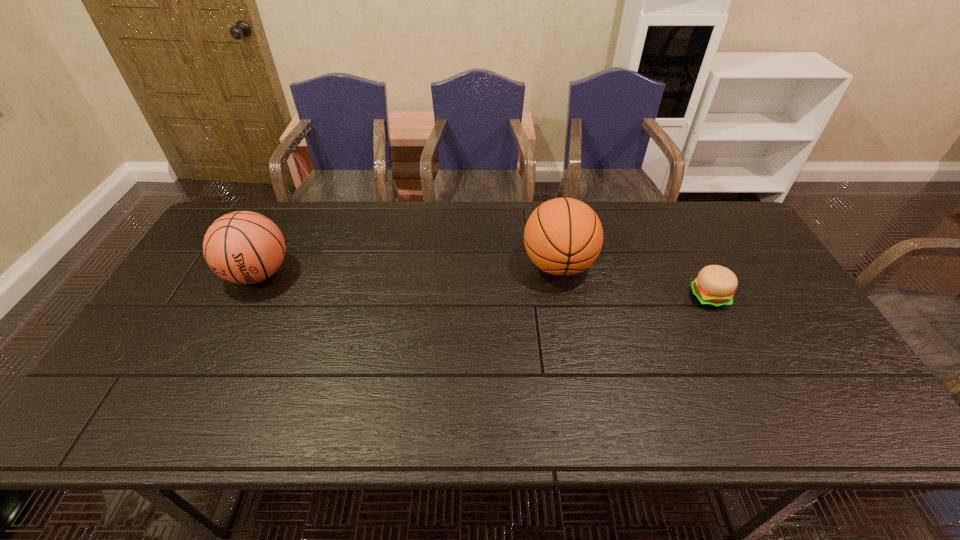
Locate an element on the screen. Image resolution: width=960 pixels, height=540 pixels. free spot that satisfies the following two spatial constraints: 1. on the front side of the right basketball; 2. on the left side of the rightmost object is located at coordinates (564, 297).

You are a GUI agent. You are given a task and a screenshot of the screen. Output one action in this format:
    pyautogui.click(x=<x>, y=<y>)
    Task: Click on the free location that satisfies the following two spatial constraints: 1. on the surface of the rightmost object near the brand logo; 2. on the left side of the left basketball
    
    Given the screenshot: What is the action you would take?
    pyautogui.click(x=247, y=297)